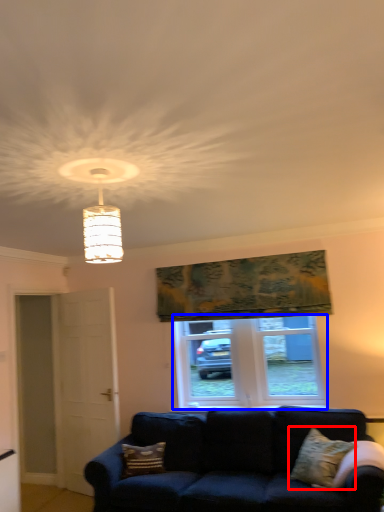
Question: Which point is further to the camera, pillow (highlighted by a red box) or window (highlighted by a blue box)?

Choices:
 (A) pillow
 (B) window

Answer: (B)